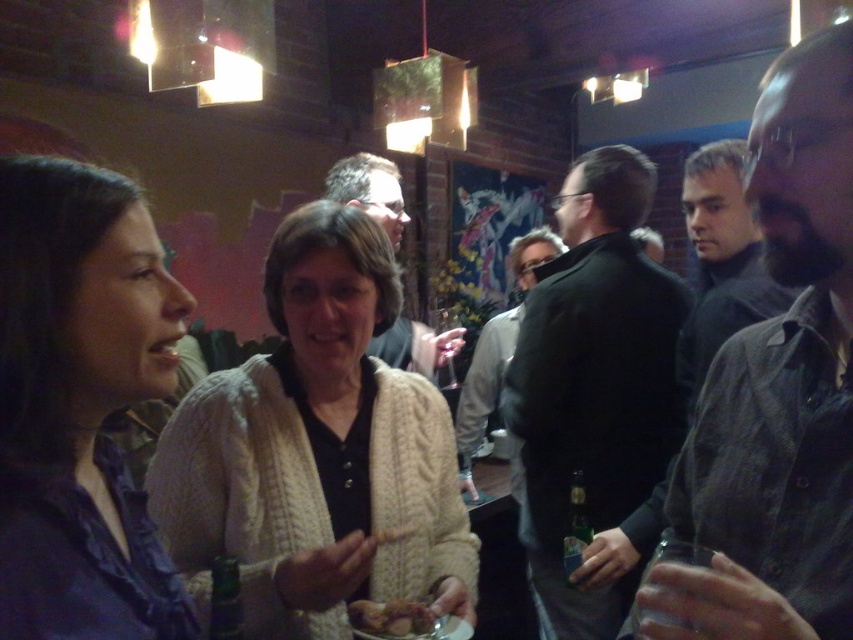
Does creamy knit sweater at center have a lesser height compared to matte blue shirt at left?

No, creamy knit sweater at center is not shorter than matte blue shirt at left.

Which is in front, point (448, 486) or point (138, 593)?

Positioned in front is point (138, 593).

This screenshot has height=640, width=853. What do you see at coordinates (318, 451) in the screenshot? I see `creamy knit sweater at center` at bounding box center [318, 451].

The width and height of the screenshot is (853, 640). I want to click on creamy knit sweater at center, so click(318, 451).

From the picture: Between creamy knit sweater at center and matte black jacket at center, which one appears on the right side from the viewer's perspective?

creamy knit sweater at center

Locate an element on the screen. The width and height of the screenshot is (853, 640). creamy knit sweater at center is located at coordinates (318, 451).

Find the location of a particular element. The height and width of the screenshot is (640, 853). creamy knit sweater at center is located at coordinates (318, 451).

Who is taller, dark gray sweater at right or brown crumbly bread at center?

dark gray sweater at right is taller.

Who is positioned more to the left, dark gray sweater at right or brown crumbly bread at center?

brown crumbly bread at center

At what (x,y) coordinates should I click in order to perform the action: click on dark gray sweater at right. Please return your answer as a coordinate pair (x, y). This screenshot has height=640, width=853. Looking at the image, I should click on [720, 260].